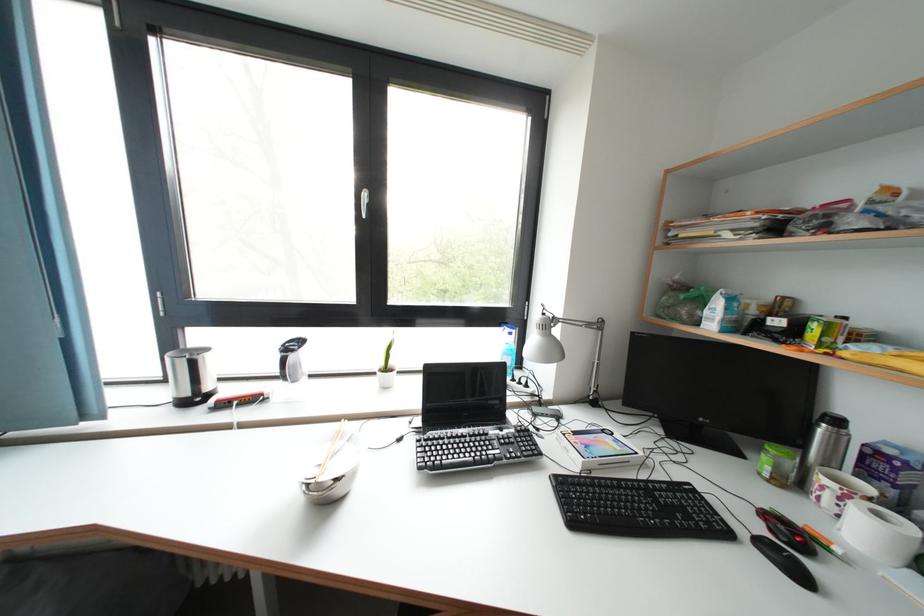
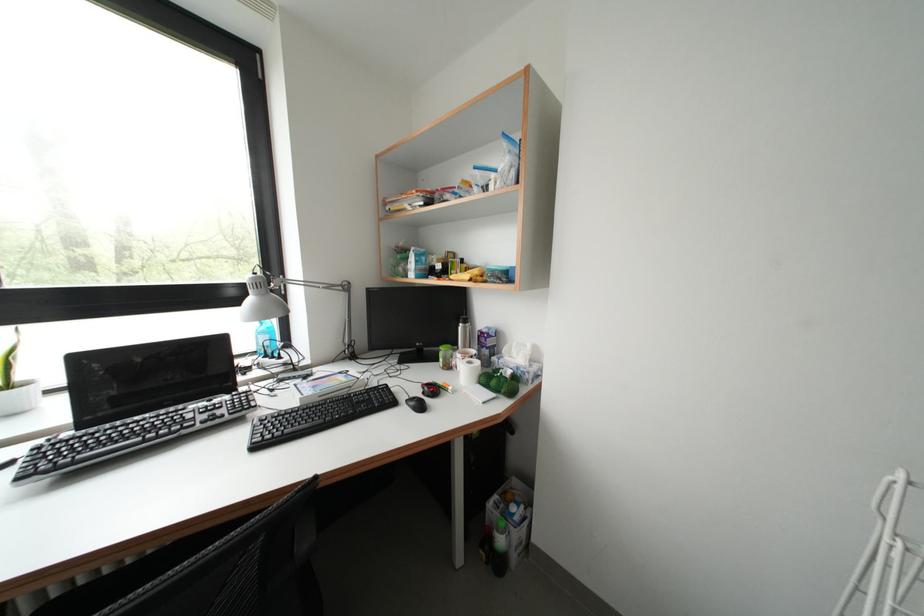
Where in the second image is the point corresponding to point 708,307 from the first image?

(415, 264)